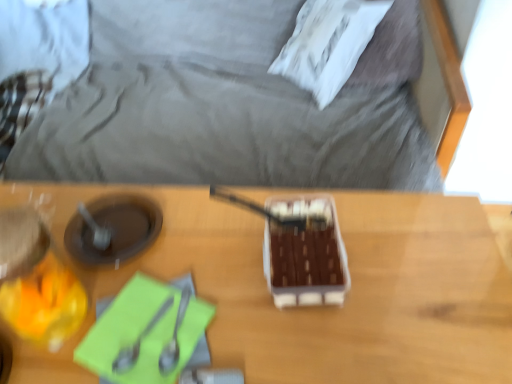
The width and height of the screenshot is (512, 384). Find the location of `vacant space in front of brown matte chocolate bar at center`. vacant space in front of brown matte chocolate bar at center is located at coordinates (330, 338).